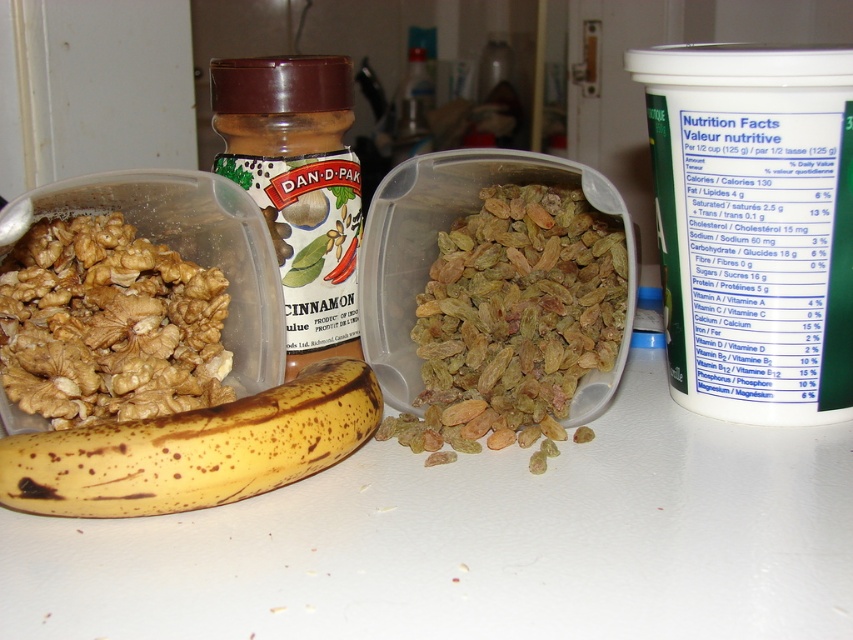
Question: In this image, where is light brown dried at center located relative to yellow spotted banana at lower left?

Choices:
 (A) above
 (B) below

Answer: (A)

Question: Which of the following is the closest to the observer?

Choices:
 (A) (144, 385)
 (B) (486, 372)

Answer: (A)

Question: Can you confirm if brown textured walnut at left is smaller than yellow spotted banana at lower left?

Choices:
 (A) yes
 (B) no

Answer: (B)

Question: Does brown textured walnut at left lie behind yellow spotted banana at lower left?

Choices:
 (A) yes
 (B) no

Answer: (A)

Question: Which is farther from the light brown dried at center?

Choices:
 (A) brown textured walnut at left
 (B) yellow spotted banana at lower left

Answer: (A)

Question: Based on their relative distances, which object is farther from the yellow spotted banana at lower left?

Choices:
 (A) light brown dried at center
 (B) brown textured walnut at left

Answer: (A)